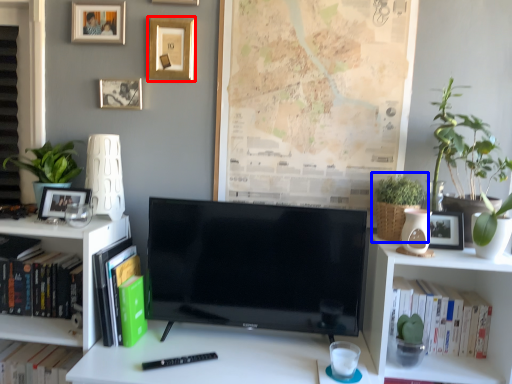
Question: Among these objects, which one is nearest to the camera, picture frame (highlighted by a red box) or houseplant (highlighted by a blue box)?

Choices:
 (A) picture frame
 (B) houseplant

Answer: (B)